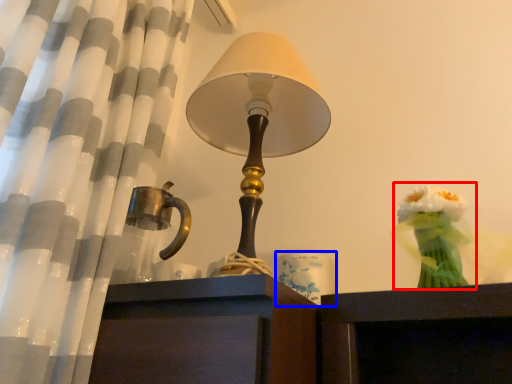
Question: Which object is further to the camera taking this photo, floral arrangement (highlighted by a red box) or candle holder (highlighted by a blue box)?

Choices:
 (A) floral arrangement
 (B) candle holder

Answer: (B)